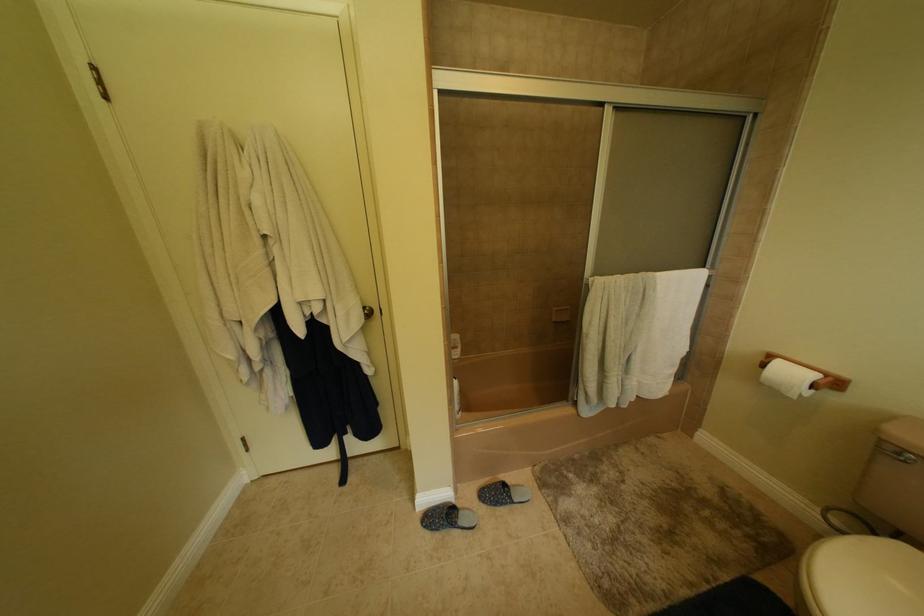
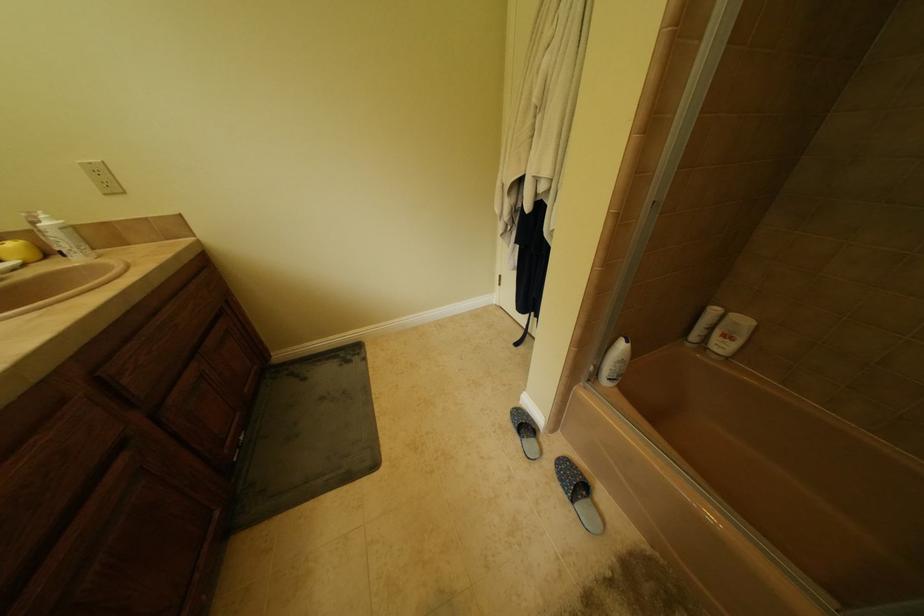
Based on the continuous images, in which direction is the camera rotating?

The rotation direction of the camera is left-down.